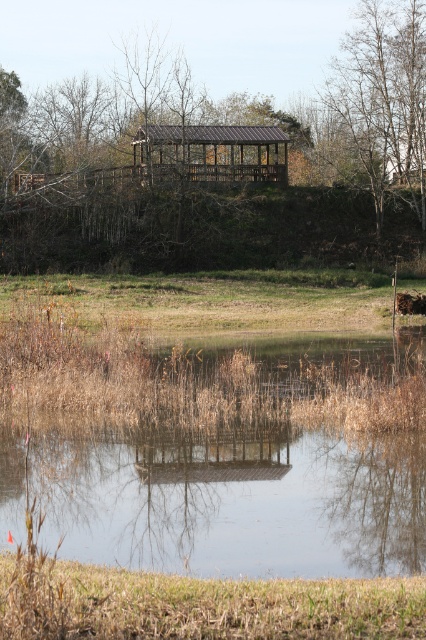
Is point (331, 625) positioned before point (213, 326)?

Yes, it is in front of point (213, 326).

Who is taller, dry grass at lower center or green grass at center?

green grass at center

Does point (342, 627) lie behind point (19, 296)?

No, (342, 627) is in front of (19, 296).

This screenshot has height=640, width=426. I want to click on dry grass at lower center, so click(x=198, y=604).

Who is higher up, transparent glass lake at center or brown leafy tree at upper right?

brown leafy tree at upper right

Is transparent glass lake at center taller than brown leafy tree at upper right?

Incorrect, transparent glass lake at center's height is not larger of brown leafy tree at upper right's.

Identify the location of transparent glass lake at center. (235, 502).

Can you confirm if green grass at center is positioned above brown leafy tree at upper right?

Actually, green grass at center is below brown leafy tree at upper right.

Is green grass at center to the left of brown leafy tree at upper right from the viewer's perspective?

Yes, green grass at center is to the left of brown leafy tree at upper right.

Is point (408, 320) farther from viewer compared to point (423, 138)?

No, (408, 320) is closer to viewer.

Where is `green grass at center`? This screenshot has height=640, width=426. green grass at center is located at coordinates (207, 300).